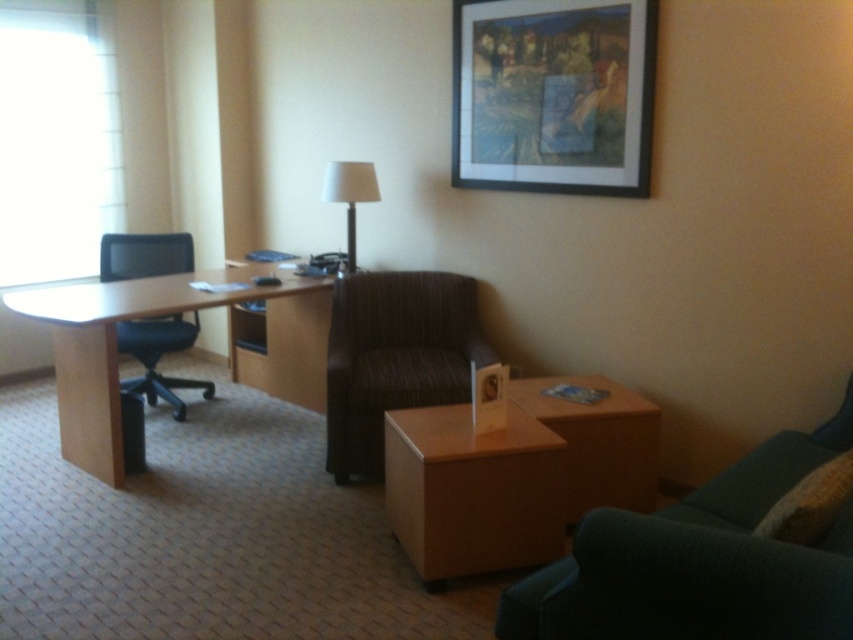
Does wooden framed artwork at upper center have a smaller size compared to light brown wood desk at left?

Yes.

Does wooden framed artwork at upper center have a larger size compared to light brown wood desk at left?

Incorrect, wooden framed artwork at upper center is not larger than light brown wood desk at left.

Between point (532, 12) and point (165, 280), which one is positioned behind?

Point (165, 280)

Identify the location of wooden framed artwork at upper center. (553, 93).

Between green fabric swivel chair at lower right and matte plastic picture frame at center, which one has less height?

matte plastic picture frame at center is shorter.

Between point (843, 570) and point (480, 408), which one is positioned in front?

Positioned in front is point (843, 570).

This screenshot has height=640, width=853. Find the location of `green fabric swivel chair at lower right`. green fabric swivel chair at lower right is located at coordinates tap(700, 561).

Is brown striped armchair at center below light brown wood desk at left?

Correct, brown striped armchair at center is located below light brown wood desk at left.

In the scene shown: Between brown striped armchair at center and light brown wood desk at left, which one has more height?

light brown wood desk at left

Identify the location of brown striped armchair at center. (395, 356).